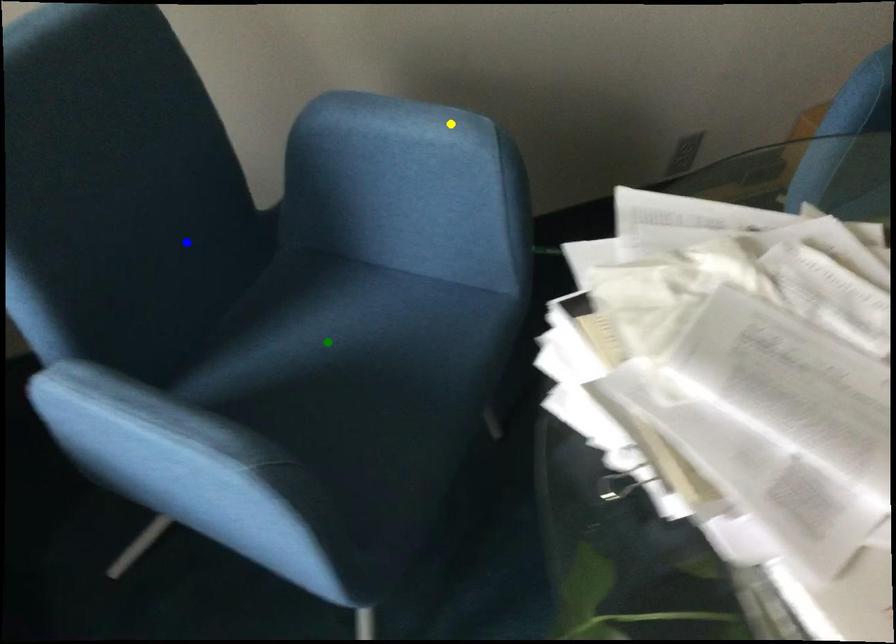
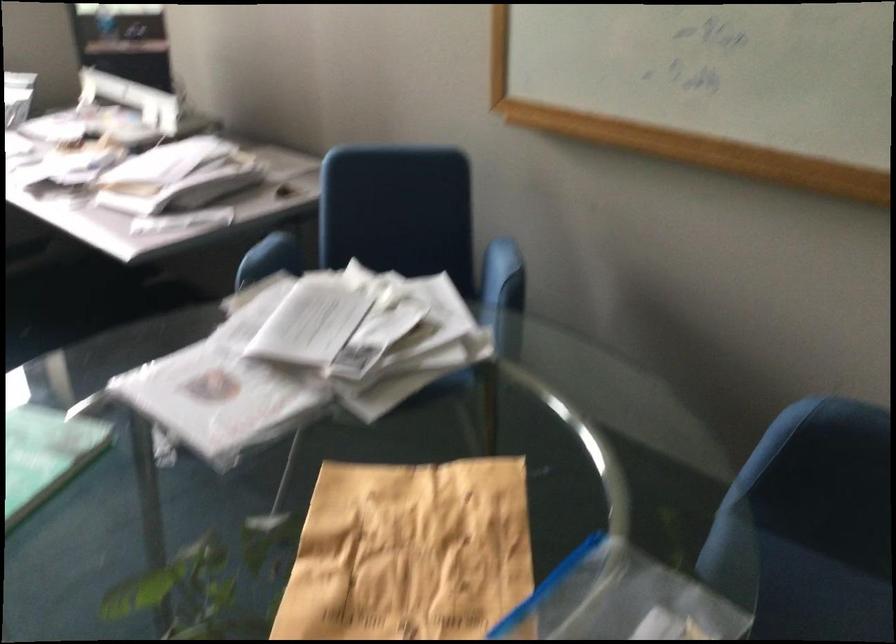
I am providing you with two images of the same scene from different viewpoints. Three points are marked in image1. Which point corresponds to a part or object that is occluded in image2?In image1, three points are marked. Which of them correspond to a part or object that is occluded in image2?Among the three points shown in image1, which one corresponds to a part or object that is no longer visible due to occlusion in image2?

green point